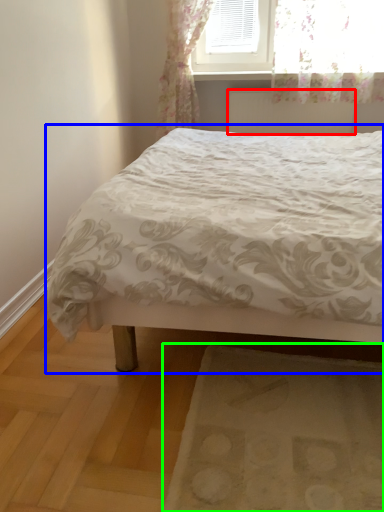
Question: Based on their relative distances, which object is nearer to radiator (highlighted by a red box)? Choose from bed (highlighted by a blue box) and mat (highlighted by a green box).

Choices:
 (A) bed
 (B) mat

Answer: (A)